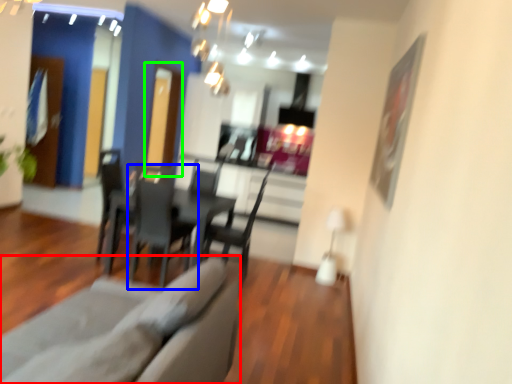
Question: Which object is positioned closest to couch (highlighted by a red box)? Select from chair (highlighted by a blue box) and glass door (highlighted by a green box).

Choices:
 (A) chair
 (B) glass door

Answer: (A)